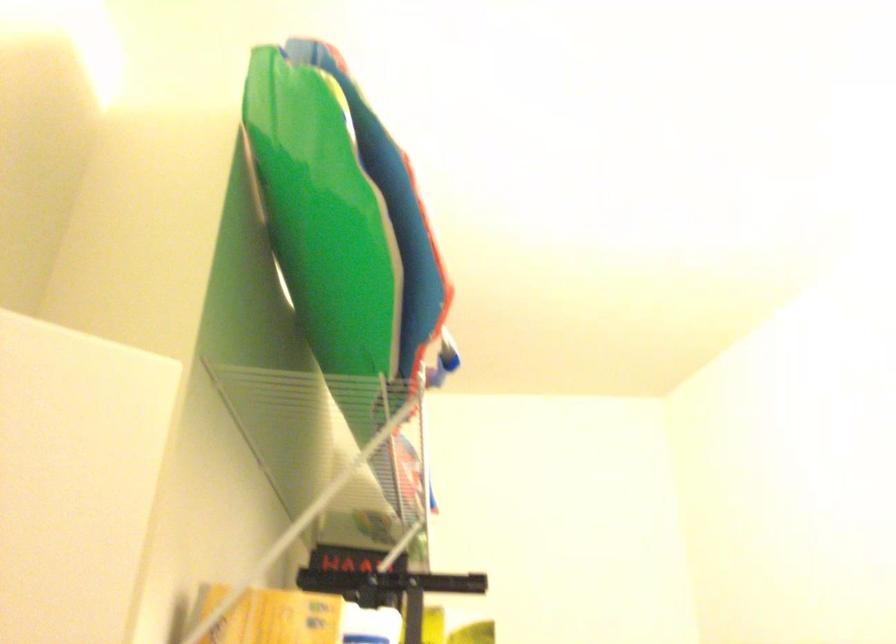
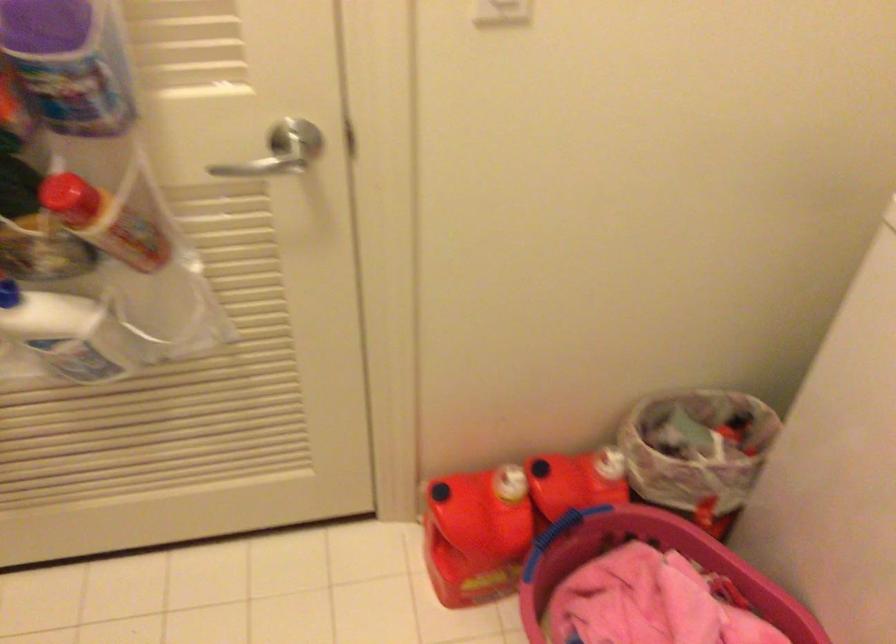
How did the camera likely rotate?

The camera rotated toward right-down.